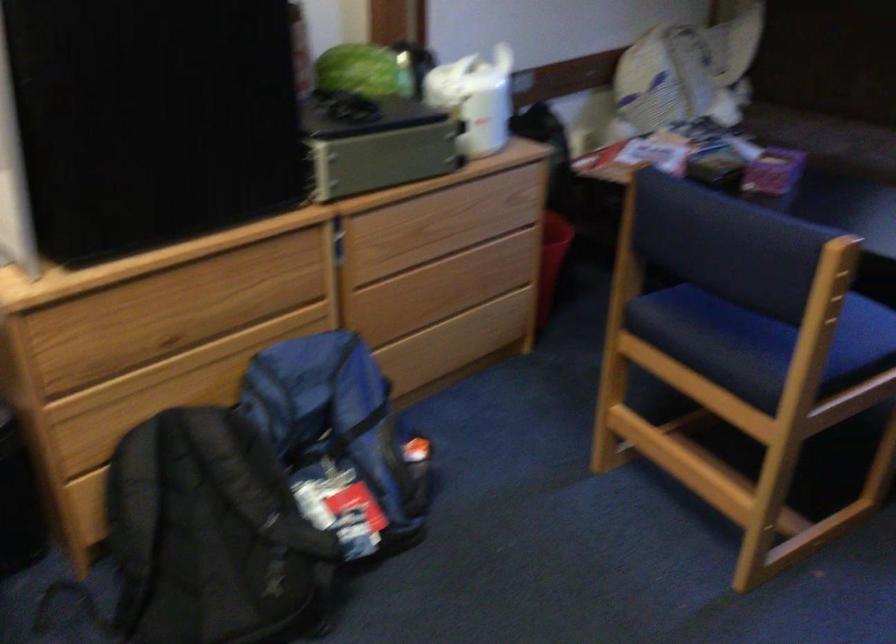
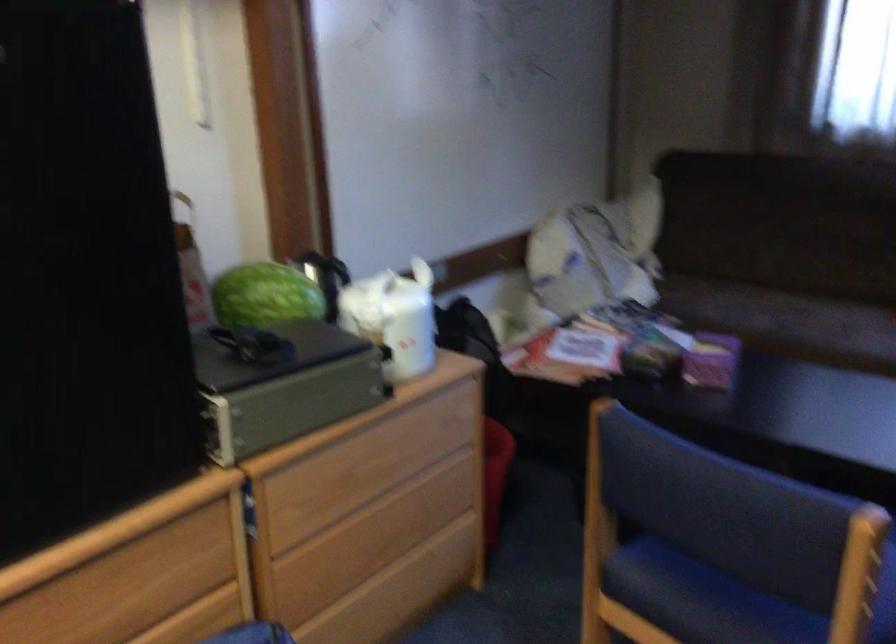
Find the pixel in the second image that matches (x=444, y=214) in the first image.

(373, 457)